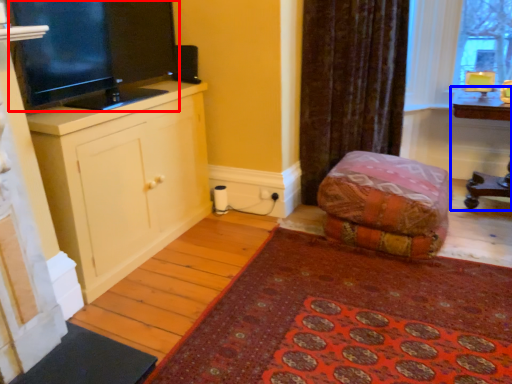
Question: Which object appears closest to the camera in this image, television (highlighted by a red box) or table (highlighted by a blue box)?

Choices:
 (A) television
 (B) table

Answer: (A)